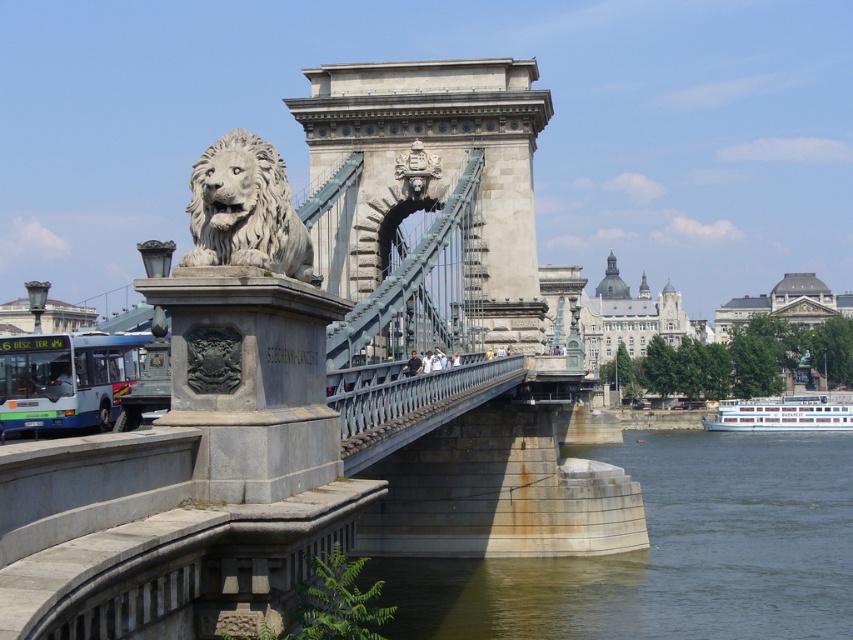
Which is more to the left, stone suspension bridge at center or white stone lion at upper left?

Positioned to the left is white stone lion at upper left.

Is stone suspension bridge at center wider than white stone lion at upper left?

Yes, stone suspension bridge at center is wider than white stone lion at upper left.

Where is `stone suspension bridge at center`? stone suspension bridge at center is located at coordinates (318, 388).